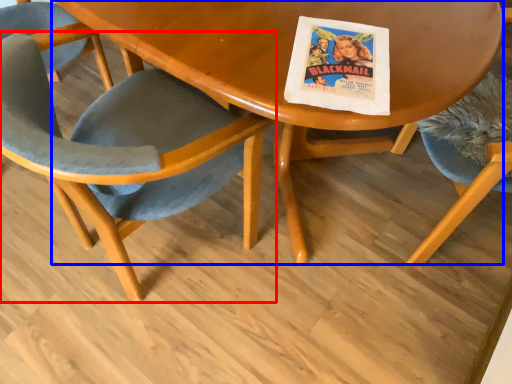
Question: Which point is further to the camera, chair (highlighted by a red box) or table (highlighted by a blue box)?

Choices:
 (A) chair
 (B) table

Answer: (B)